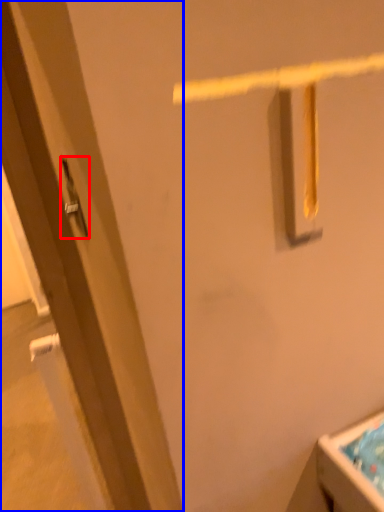
Question: Which point is closer to the camera, door handle (highlighted by a red box) or door (highlighted by a blue box)?

Choices:
 (A) door handle
 (B) door

Answer: (B)